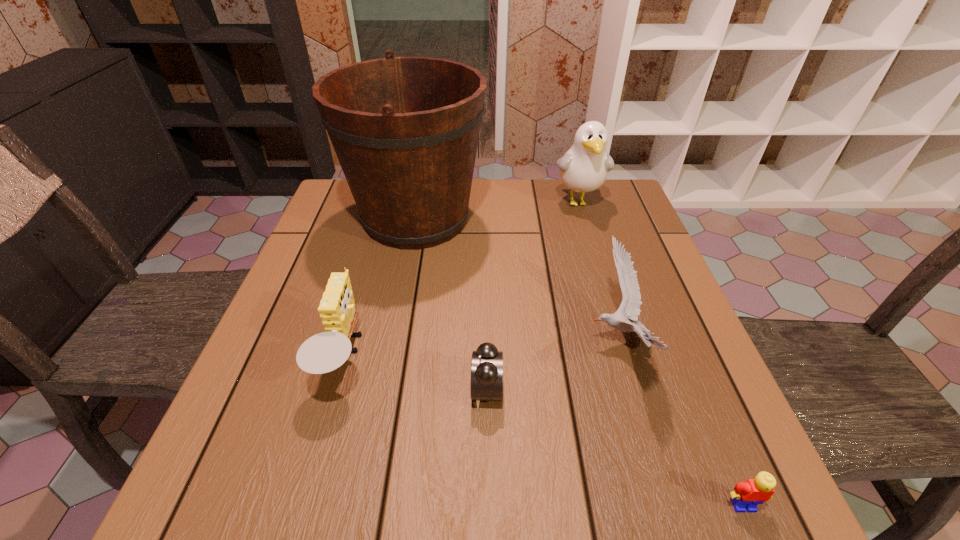
You are a GUI agent. You are given a task and a screenshot of the screen. Output one action in this format:
    pyautogui.click(x=<x>, y=<y>)
    Task: Click on the free point at the near left corner
    Image resolution: width=960 pixels, height=540 pixels.
    Given the screenshot: What is the action you would take?
    pyautogui.click(x=216, y=486)

The height and width of the screenshot is (540, 960). In order to click on free point between the sponge and the bucket in this screenshot , I will do `click(381, 288)`.

Where is `free space between the shorter gull and the farther gull`? The height and width of the screenshot is (540, 960). free space between the shorter gull and the farther gull is located at coordinates (599, 271).

You are a GUI agent. You are given a task and a screenshot of the screen. Output one action in this format:
    pyautogui.click(x=<x>, y=<y>)
    Task: Click on the free space between the shorter gull and the nearest object
    
    Given the screenshot: What is the action you would take?
    pyautogui.click(x=682, y=423)

The image size is (960, 540). I want to click on vacant area between the Lego and the sponge, so click(x=544, y=431).

At what (x,y) coordinates should I click in order to perform the action: click on free space between the taller gull and the sponge. Please return your answer as a coordinate pair (x, y). Looking at the image, I should click on click(x=462, y=279).

Where is `free point between the nearer gull and the alarm clock`? free point between the nearer gull and the alarm clock is located at coordinates (553, 366).

The width and height of the screenshot is (960, 540). I want to click on free space between the bucket and the farther gull, so click(497, 210).

Identify the location of object that stands as the second closest to the second tallest object. The width and height of the screenshot is (960, 540). (630, 306).

You are a GUI agent. You are given a task and a screenshot of the screen. Output one action in this format:
    pyautogui.click(x=<x>, y=<y>)
    Task: Click on the object that is the fourth closest one to the shorter gull
    
    Given the screenshot: What is the action you would take?
    pyautogui.click(x=584, y=168)